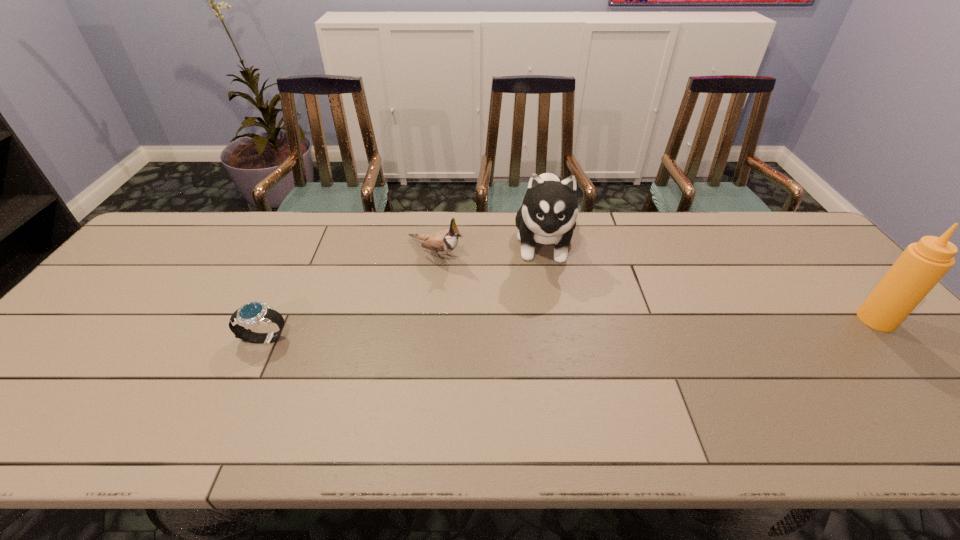
Find the location of a particular element. Image resolution: width=960 pixels, height=540 pixels. free space at the right edge of the desktop is located at coordinates (837, 275).

Locate an element on the screen. This screenshot has height=540, width=960. vacant area at the far right corner is located at coordinates (779, 247).

Find the location of a particular element. This screenshot has width=960, height=540. vacant area that lies between the watch and the puppy is located at coordinates (404, 291).

At what (x,y) coordinates should I click in order to perform the action: click on vacant area between the second shortest object and the second object from right to left. Please return your answer as a coordinate pair (x, y). The width and height of the screenshot is (960, 540). Looking at the image, I should click on (490, 248).

Where is `free spot between the rightmost object and the second shortest object`? This screenshot has width=960, height=540. free spot between the rightmost object and the second shortest object is located at coordinates (656, 286).

This screenshot has height=540, width=960. Find the location of `unoccupied area between the puppy and the third object from right to left`. unoccupied area between the puppy and the third object from right to left is located at coordinates (490, 248).

At what (x,y) coordinates should I click in order to perform the action: click on blank region between the bird and the puppy. Please return your answer as a coordinate pair (x, y). Image resolution: width=960 pixels, height=540 pixels. Looking at the image, I should click on (490, 248).

Where is `unoccupied area between the condiment and the puppy`? unoccupied area between the condiment and the puppy is located at coordinates (710, 281).

Where is `vacant area between the condiment and the leftmost object`? The image size is (960, 540). vacant area between the condiment and the leftmost object is located at coordinates (570, 329).

Find the location of `free space between the rightmost object and the shortest object`. free space between the rightmost object and the shortest object is located at coordinates (570, 329).